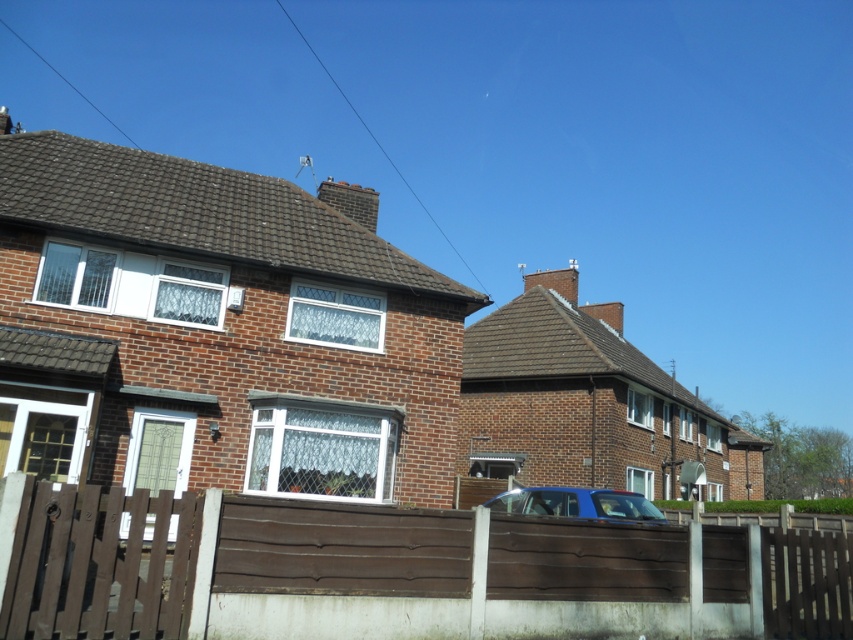
You are standing in front of the brown wooden fence at center and the blue matte car at center. Which object is larger in size?

The blue matte car at center is larger than the brown wooden fence at center.

Based on the photo, you are a delivery driver who needs to park your blue matte car at center in a parking spot that is exactly the same width as the brown wooden fence at center. Will the car fit into the parking spot?

The brown wooden fence at center is narrower than the blue matte car at center, so the parking spot is narrower than the car. Therefore, the blue matte car at center will not fit into the parking spot.

You are a delivery person trying to see if you can spot the blue matte car at center from behind the brown wooden fence at center. Can you see the car clearly?

The brown wooden fence at center is not as tall as the blue matte car at center, so yes, you can see the car clearly over the fence.